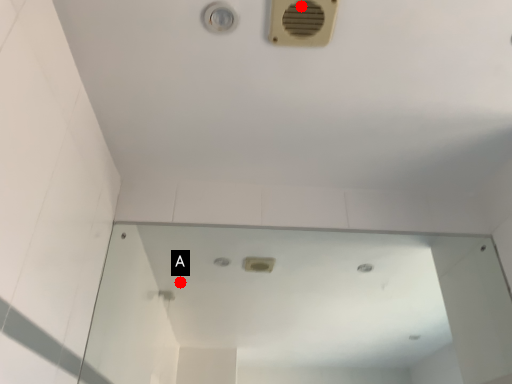
Question: Two points are circled on the image, labeled by A and B beside each circle. Which point appears farthest from the camera in this image?

Choices:
 (A) A is further
 (B) B is further

Answer: (A)